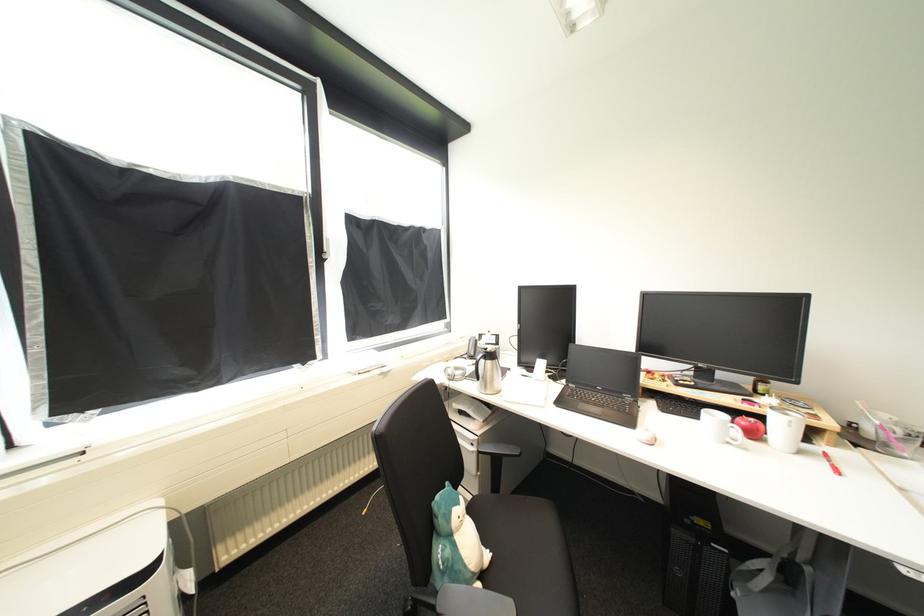
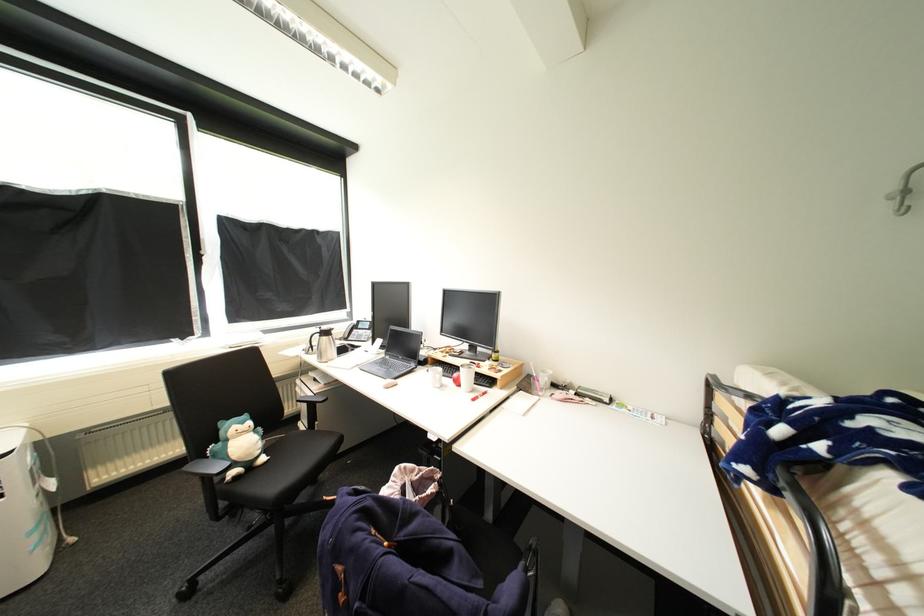
The point at (466, 505) is marked in the first image. Where is the corresponding point in the second image?

(249, 424)